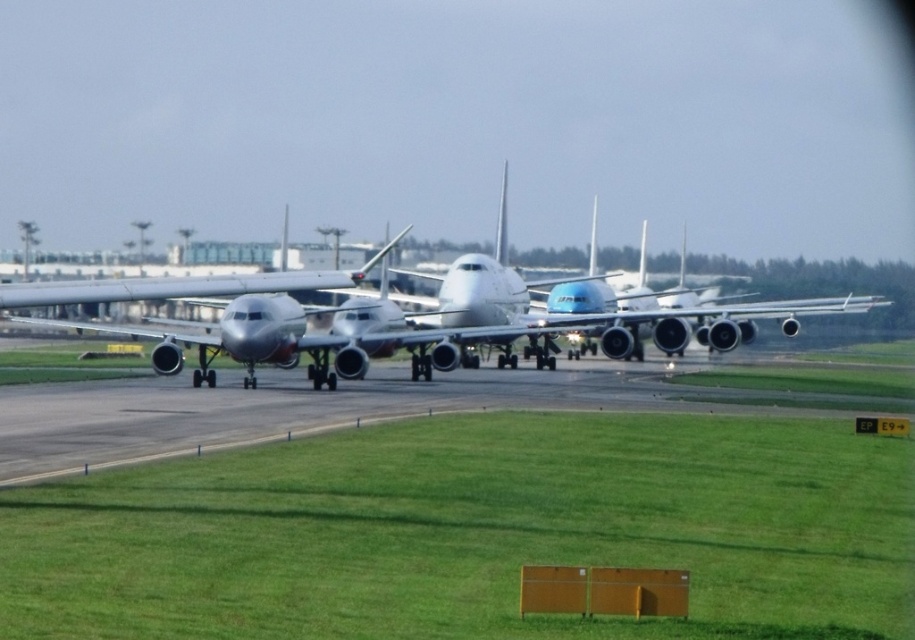
You are standing at the orange structure in the foreground of the airport tarmac scene. You see two points marked as point 1 and point 2. Point 1 is at coordinates point (905,520) and point 2 is at point (580,321). Which point is closer to your current position?

Point 1 at coordinates point (905,520) is closer to your current position at the orange structure in the foreground because it is closer to the camera than point 2 at (580,321).

You are a pilot standing at the edge of the tarmac near the green grass at lower center. You need to walk to the metallic silver airplane at center to board it. Which direction should you walk to reach the airplane?

You should walk to the right because the green grass at lower center is positioned on the left side of the metallic silver airplane at center, so moving right will lead you towards the airplane.

You are standing at the point marked as point (x=472, y=532) in the image. Looking around, you see a row of commercial airplanes parked on the tarmac. Which direction should you walk to reach the nearest airplane?

The point (x=472, y=532) is on green grass at lower center. The airplanes are parked on the tarmac, which is likely in front of the grass area. To reach the nearest airplane, you should walk forward towards the tarmac where the airplanes are parked.